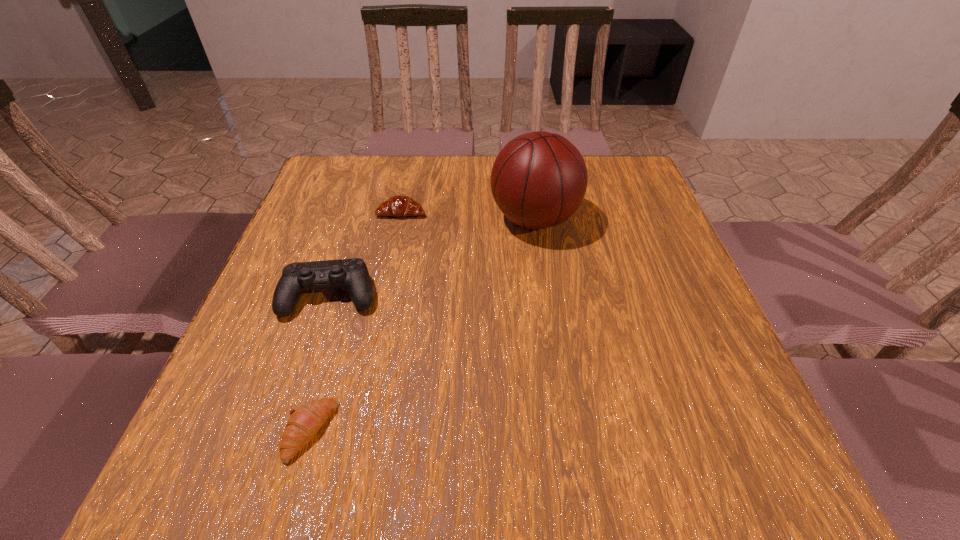
Locate an element on the screen. vacant point located between the nearest object and the tallest object is located at coordinates (422, 325).

The image size is (960, 540). Find the location of `vacant region between the second tallest object and the taller crescent roll`. vacant region between the second tallest object and the taller crescent roll is located at coordinates (366, 254).

Identify the location of empty space between the shorter crescent roll and the second tallest object. The width and height of the screenshot is (960, 540). (321, 363).

Image resolution: width=960 pixels, height=540 pixels. I want to click on object that is the second closest to the nearest object, so click(x=538, y=180).

Identify which object is the third closest to the third shortest object. Please provide its 2D coordinates. Your answer should be formatted as a tuple, i.e. [(x, y)], where the tuple contains the x and y coordinates of a point satisfying the conditions above.

[(538, 180)]

This screenshot has width=960, height=540. I want to click on vacant space that satisfies the following two spatial constraints: 1. on the front side of the taller crescent roll; 2. on the left side of the rightmost object, so click(x=400, y=219).

In order to click on free space that satisfies the following two spatial constraints: 1. on the back side of the nearer crescent roll; 2. on the left side of the rightmost object in this screenshot , I will do `click(371, 219)`.